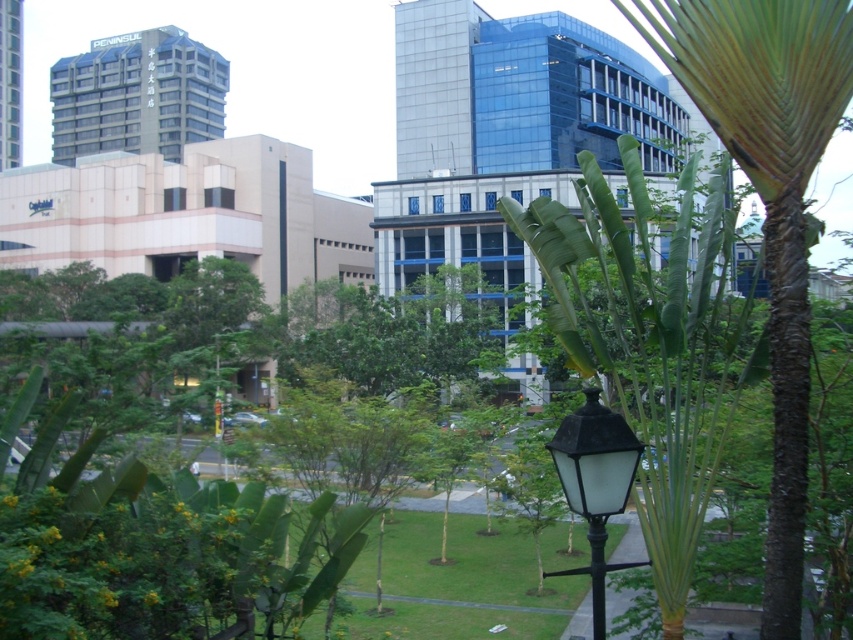
You are a city planner assessing the urban space. You need to determine if the green leafy palm tree at center will block the light from the black glass street light at center. Based on their heights, what is your conclusion?

The green leafy palm tree at center is much taller than the black glass street light at center, so it could potentially block the light from the black glass street light at center.

You are a city planner assessing the urban landscape. You need to determine if the green leafy palm at center will block the light from the black glass street light at center. Based on their heights, what is your conclusion?

The green leafy palm at center is taller than the black glass street light at center, so it may block the light from the street light.

You are a city planner designing a walking path between the green leafy palm tree at center and the green leafy palm at center. What is the minimum width required for the path to ensure both palms are accessible without encroaching on their root zones?

The minimum width required for the path is 10.87 feet to ensure both green leafy palm tree at center and green leafy palm at center are accessible without encroaching on their root zones.